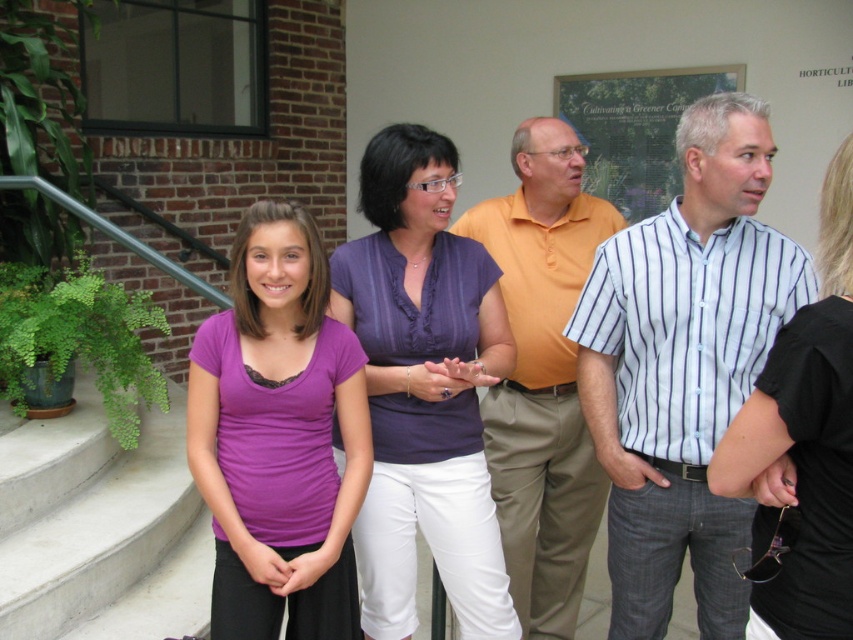
You are organizing a photo shoot and need to arrange two shirts, the striped cotton shirt at center and the black matte shirt at center, on a mannequin. Based on their widths, which shirt should you place on the left side to ensure they don not overlap?

The striped cotton shirt at center is wider than the black matte shirt at center, so placing the striped cotton shirt at center on the left side would prevent overlapping since it takes up more space.

You are attending a community event and see two people wearing purple satin blouse at center and black matte shirt at center. Which one is standing to the left of the other?

The purple satin blouse at center is positioned on the left side of black matte shirt at center.

You are standing in front of the building and want to determine which of the two points, point (440,330) or point (788,614), is closer to you. Based on the image, which point is nearer?

Point (440,330) is closer to you because it is further to the viewer than point (788,614).